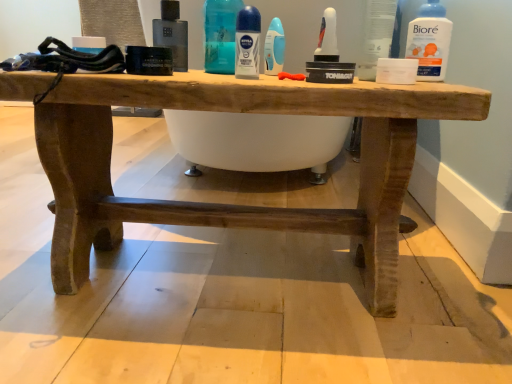
What are the coordinates of `vacant space behind rustic wood table at center` in the screenshot? It's located at (214, 188).